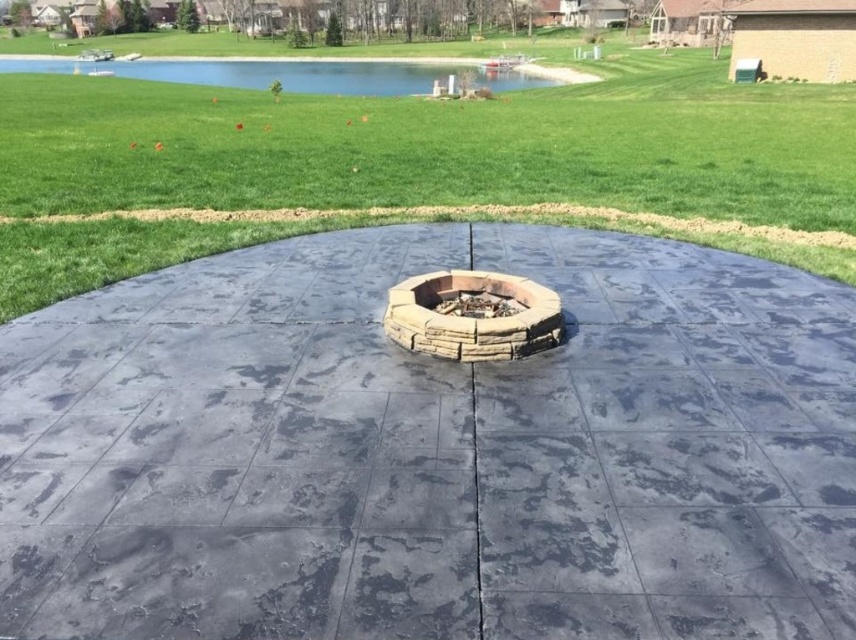
Question: Estimate the real-world distances between objects in this image. Which object is farther from the green grass at center?

Choices:
 (A) stone textured fire pit at center
 (B) gray concrete fire pit at center

Answer: (A)

Question: Is gray concrete fire pit at center thinner than green grass at center?

Choices:
 (A) yes
 (B) no

Answer: (A)

Question: Is green grass at center below stone textured fire pit at center?

Choices:
 (A) yes
 (B) no

Answer: (B)

Question: Can you confirm if gray concrete fire pit at center is thinner than stone textured fire pit at center?

Choices:
 (A) yes
 (B) no

Answer: (B)

Question: Which object is farther from the camera taking this photo?

Choices:
 (A) stone textured fire pit at center
 (B) gray concrete fire pit at center

Answer: (A)

Question: Which point appears farthest from the camera in this image?

Choices:
 (A) (328, 124)
 (B) (456, 342)

Answer: (A)